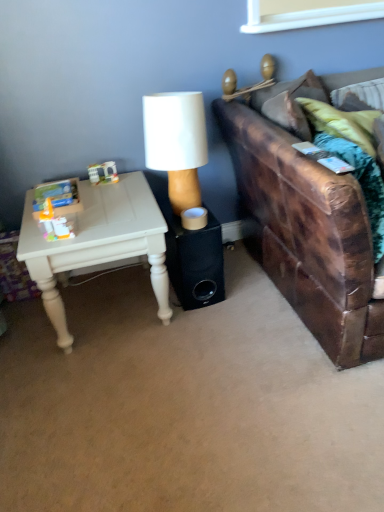
Where is `free point to the left of black matte speaker at center`? free point to the left of black matte speaker at center is located at coordinates (132, 297).